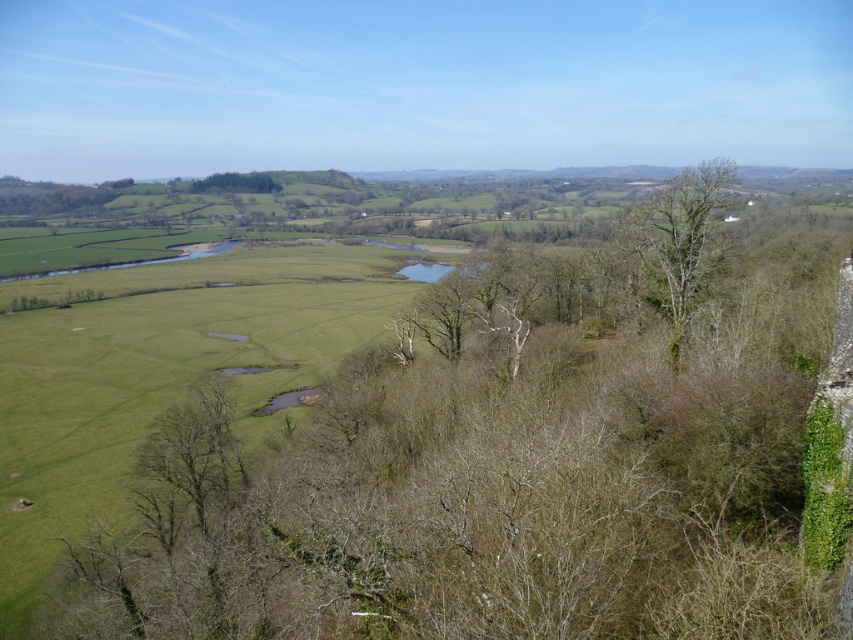
Is point (831, 289) positioned before point (636, 262)?

Yes, point (831, 289) is in front of point (636, 262).

From the picture: Who is more distant from viewer, (643, 634) or (660, 253)?

The point (660, 253) is behind.

Where is `bare branches at center`? bare branches at center is located at coordinates (521, 461).